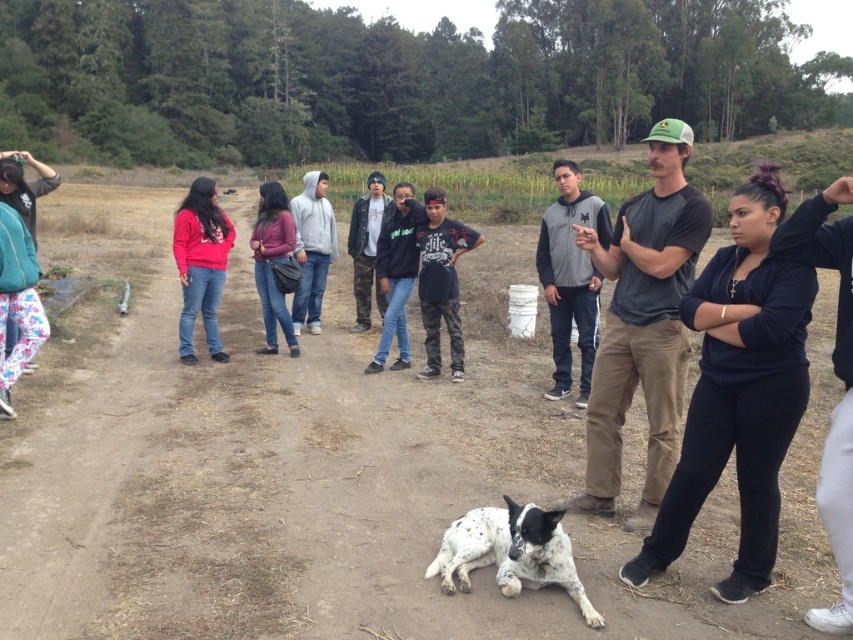
Who is lower down, white spotted fur dog at center or camouflage jacket at center?

white spotted fur dog at center is lower down.

What do you see at coordinates (511, 552) in the screenshot?
I see `white spotted fur dog at center` at bounding box center [511, 552].

This screenshot has width=853, height=640. I want to click on white spotted fur dog at center, so click(x=511, y=552).

Does point (51, 449) come behind point (491, 560)?

Yes, it is.

Who is more distant from viewer, (234, 364) or (500, 580)?

Point (234, 364)

Describe the element at coordinates (343, 496) in the screenshot. I see `brown dirt field at center` at that location.

At what (x,y) coordinates should I click in order to perform the action: click on brown dirt field at center. Please return your answer as a coordinate pair (x, y). The image size is (853, 640). Looking at the image, I should click on (343, 496).

How much distance is there between matte red hoodie at left and black matte hoodie at center?

matte red hoodie at left is 1.86 meters from black matte hoodie at center.

Between matte red hoodie at left and black matte hoodie at center, which one is positioned higher?

matte red hoodie at left is above.

Which is in front, point (213, 220) or point (395, 364)?

Point (213, 220) is more forward.

Locate an element on the screen. The height and width of the screenshot is (640, 853). matte red hoodie at left is located at coordinates (200, 264).